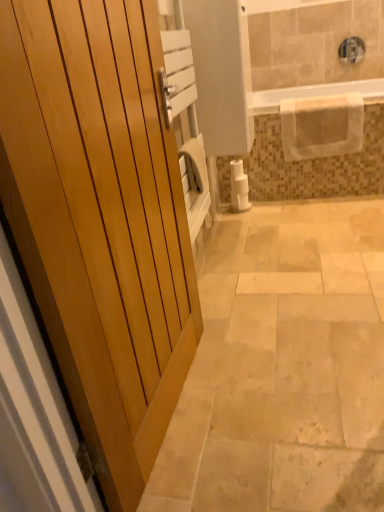
Image resolution: width=384 pixels, height=512 pixels. In order to click on clear plastic bathtub at upper center in this screenshot , I will do `click(312, 94)`.

Where is `white matte toilet paper at center-right`? This screenshot has width=384, height=512. white matte toilet paper at center-right is located at coordinates (239, 187).

The width and height of the screenshot is (384, 512). What are the coordinates of `clear plastic bathtub at upper center` in the screenshot? It's located at (312, 94).

Would you say clear plastic bathtub at upper center is inside or outside wooden door at left?

clear plastic bathtub at upper center is outside wooden door at left.

Is clear plastic bathtub at upper center oriented towards wooden door at left?

Yes, clear plastic bathtub at upper center is oriented towards wooden door at left.

Who is taller, clear plastic bathtub at upper center or wooden door at left?

wooden door at left is taller.

Looking at this image, between wooden door at left and clear plastic bathtub at upper center, which one appears on the right side from the viewer's perspective?

clear plastic bathtub at upper center is more to the right.

From a real-world perspective, is wooden door at left above or below clear plastic bathtub at upper center?

From a real-world perspective, wooden door at left is physically above clear plastic bathtub at upper center.

Considering the sizes of objects wooden door at left and clear plastic bathtub at upper center in the image provided, who is bigger, wooden door at left or clear plastic bathtub at upper center?

wooden door at left is bigger.

In the image, there is a clear plastic bathtub at upper center. Identify the location of door below it (from the image's perspective). Image resolution: width=384 pixels, height=512 pixels. (100, 219).

Is white matte toilet paper at center-right inside clear plastic bathtub at upper center?

No, clear plastic bathtub at upper center does not contain white matte toilet paper at center-right.

Is clear plastic bathtub at upper center at the left side of white matte toilet paper at center-right?

No, clear plastic bathtub at upper center is not to the left of white matte toilet paper at center-right.

From a real-world perspective, who is located higher, clear plastic bathtub at upper center or white matte toilet paper at center-right?

clear plastic bathtub at upper center is physically above.

Is clear plastic bathtub at upper center facing towards white matte toilet paper at center-right?

No, clear plastic bathtub at upper center is not aimed at white matte toilet paper at center-right.

Is clear plastic bathtub at upper center surrounded by white matte toilet paper at center-right?

Definitely not — clear plastic bathtub at upper center is not inside white matte toilet paper at center-right.

Can you confirm if white matte toilet paper at center-right is shorter than clear plastic bathtub at upper center?

No, white matte toilet paper at center-right is not shorter than clear plastic bathtub at upper center.

In the scene shown: Does white matte toilet paper at center-right come behind clear plastic bathtub at upper center?

Yes, white matte toilet paper at center-right is behind clear plastic bathtub at upper center.

Does white matte toilet paper at center-right touch clear plastic bathtub at upper center?

white matte toilet paper at center-right and clear plastic bathtub at upper center are clearly separated.

From a real-world perspective, is white matte toilet paper at center-right physically located above or below wooden door at left?

white matte toilet paper at center-right is below wooden door at left.

Which point is more distant from viewer, (236, 169) or (31, 216)?

The point (236, 169) is more distant.

Is white matte toilet paper at center-right at the right side of wooden door at left?

Yes.

Considering the sizes of objects white matte toilet paper at center-right and wooden door at left in the image provided, who is bigger, white matte toilet paper at center-right or wooden door at left?

With larger size is wooden door at left.

Is white matte toilet paper at center-right located within wooden door at left?

That's incorrect, white matte toilet paper at center-right is not inside wooden door at left.

Is wooden door at left taller than white matte toilet paper at center-right?

Correct, wooden door at left is much taller as white matte toilet paper at center-right.

Considering the relative positions of wooden door at left and white matte toilet paper at center-right in the image provided, is wooden door at left to the left or to the right of white matte toilet paper at center-right?

wooden door at left is to the left of white matte toilet paper at center-right.

Measure the distance from wooden door at left to white matte toilet paper at center-right.

wooden door at left and white matte toilet paper at center-right are 1.90 meters apart from each other.

Find the location of a particular element. This screenshot has height=512, width=384. door on the left of the clear plastic bathtub at upper center is located at coordinates (100, 219).

Locate an element on the screen. door above the clear plastic bathtub at upper center (from a real-world perspective) is located at coordinates (100, 219).

From the image, which object appears to be nearer to wooden door at left, white matte toilet paper at center-right or clear plastic bathtub at upper center?

The object closer to wooden door at left is white matte toilet paper at center-right.

When comparing their distances from wooden door at left, does clear plastic bathtub at upper center or white matte toilet paper at center-right seem closer?

white matte toilet paper at center-right.

Considering their positions, is clear plastic bathtub at upper center positioned further to white matte toilet paper at center-right than wooden door at left?

Based on the image, wooden door at left appears to be further to white matte toilet paper at center-right.

Considering their positions, is white matte toilet paper at center-right positioned closer to clear plastic bathtub at upper center than wooden door at left?

white matte toilet paper at center-right is positioned closer to the anchor clear plastic bathtub at upper center.

Based on the photo, from the image, which object appears to be nearer to clear plastic bathtub at upper center, wooden door at left or white matte toilet paper at center-right?

white matte toilet paper at center-right is closer to clear plastic bathtub at upper center.

Which object lies further to the anchor point white matte toilet paper at center-right, wooden door at left or clear plastic bathtub at upper center?

Among the two, wooden door at left is located further to white matte toilet paper at center-right.

This screenshot has height=512, width=384. I want to click on bathtub located between wooden door at left and white matte toilet paper at center-right in the depth direction, so 312,94.